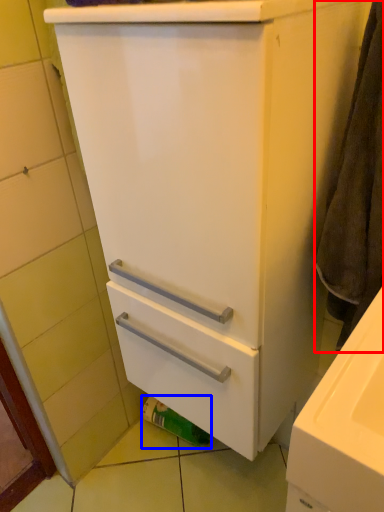
Question: Which object appears closest to the camera in this image, bath towel (highlighted by a red box) or toilet paper (highlighted by a blue box)?

Choices:
 (A) bath towel
 (B) toilet paper

Answer: (A)